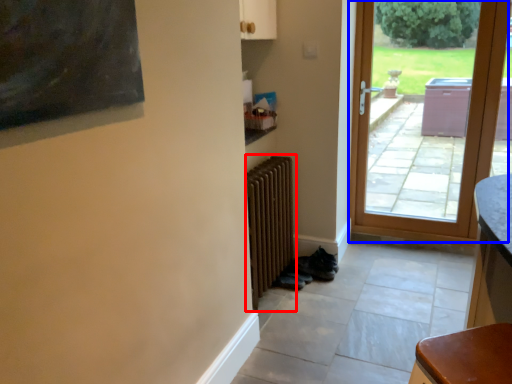
Question: Among these objects, which one is farthest to the camera, radiator (highlighted by a red box) or door (highlighted by a blue box)?

Choices:
 (A) radiator
 (B) door

Answer: (B)